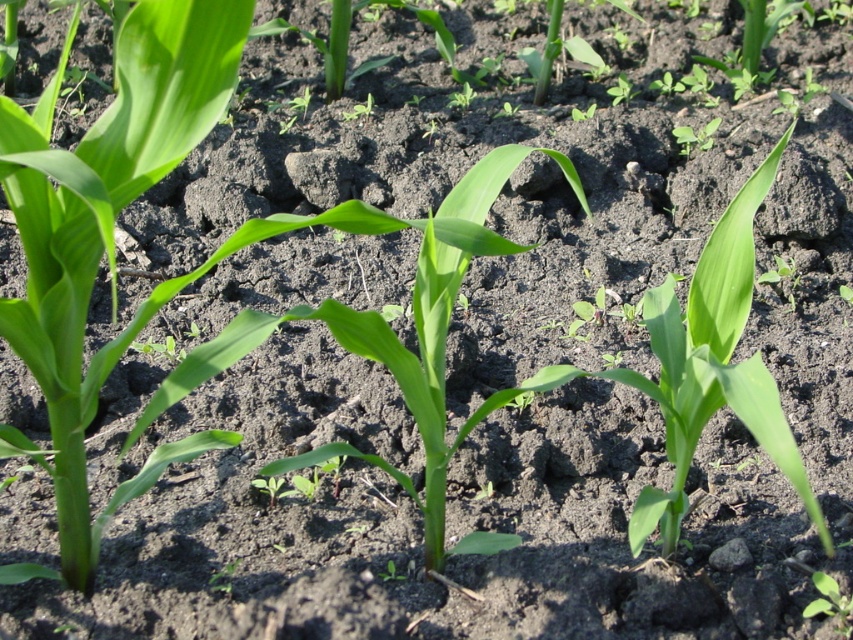
You are a farmer inspecting corn plants in your field. You notice two green leafy plant at center and green leafy plant at lower right. Which one would you need to bend down more to examine closely?

The green leafy plant at lower right requires bending down more because it is farther from the viewer compared to the green leafy plant at center.

You are a farmer inspecting your cornfield. You notice two green leafy plants in your field. One is at the center and the other at lower right. Which plant is located more to the left when comparing the green leafy plant at center and the green leafy plant at lower right?

The green leafy plant at center is positioned on the left side of the green leafy plant at lower right, so the one at center is more to the left.